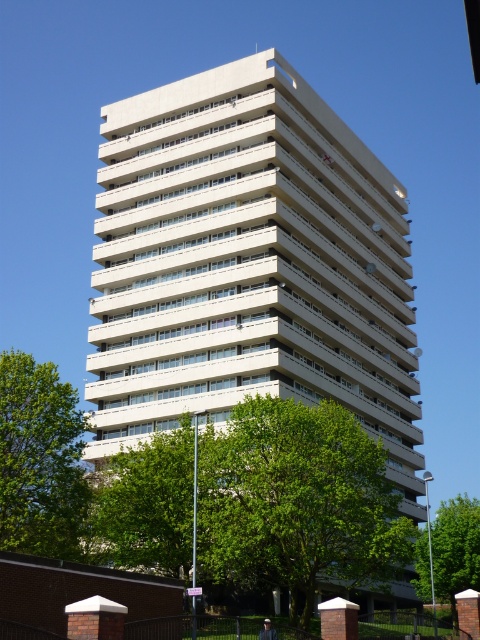
Is green leafy tree at lower center thinner than green leafy tree at lower left?

Incorrect, green leafy tree at lower center's width is not less than green leafy tree at lower left's.

Between green leafy tree at lower center and green leafy tree at lower left, which one has more height?

With more height is green leafy tree at lower center.

Does point (267, 576) lie in front of point (49, 419)?

That is False.

I want to click on green leafy tree at lower center, so coord(298,500).

Who is higher up, white smooth building at center or green leafy tree at lower left?

white smooth building at center

This screenshot has height=640, width=480. What do you see at coordinates (249, 262) in the screenshot?
I see `white smooth building at center` at bounding box center [249, 262].

This screenshot has width=480, height=640. I want to click on white smooth building at center, so click(249, 262).

Is green leafy tree at lower center thinner than green leafy tree at center?

Indeed, green leafy tree at lower center has a lesser width compared to green leafy tree at center.

Can you confirm if green leafy tree at lower center is positioned to the left of green leafy tree at center?

Indeed, green leafy tree at lower center is positioned on the left side of green leafy tree at center.

Which is in front, point (288, 406) or point (420, 552)?

Point (288, 406) is more forward.

I want to click on green leafy tree at lower center, so click(x=298, y=500).